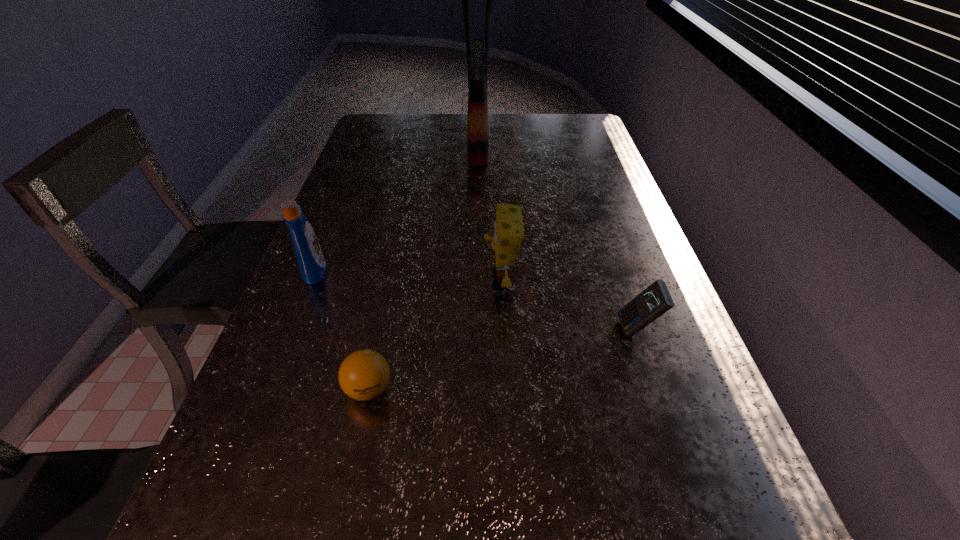
The width and height of the screenshot is (960, 540). I want to click on object located at the right edge, so click(x=655, y=300).

Where is `vacant space at the far edge of the desktop`? The height and width of the screenshot is (540, 960). vacant space at the far edge of the desktop is located at coordinates (464, 137).

Find the location of a particular element. The image size is (960, 540). vacant space at the left edge of the desktop is located at coordinates click(333, 197).

In the image, there is a desktop. Find the location of `free space at the right edge`. free space at the right edge is located at coordinates (611, 166).

You are a GUI agent. You are given a task and a screenshot of the screen. Output one action in this format:
    pyautogui.click(x=<x>, y=<y>)
    Task: Click on the free point at the far right corner
    
    Given the screenshot: What is the action you would take?
    pyautogui.click(x=571, y=137)

What are the coordinates of `free spot between the fourth farthest object and the second tallest object` in the screenshot? It's located at (476, 300).

Image resolution: width=960 pixels, height=540 pixels. In order to click on vacant area that lies between the fourth farthest object and the shortest object in this screenshot , I will do `click(503, 359)`.

Where is `free spot between the nearest object and the second shortest object`? This screenshot has height=540, width=960. free spot between the nearest object and the second shortest object is located at coordinates (503, 359).

Find the location of a particular element. The height and width of the screenshot is (540, 960). vacant space in between the fourth shortest object and the farthest object is located at coordinates (396, 205).

You are a GUI agent. You are given a task and a screenshot of the screen. Output one action in this format:
    pyautogui.click(x=<x>, y=<y>)
    Task: Click on the unoccupied position between the farthest object and the ping-pong ball
    
    Given the screenshot: What is the action you would take?
    pyautogui.click(x=423, y=265)